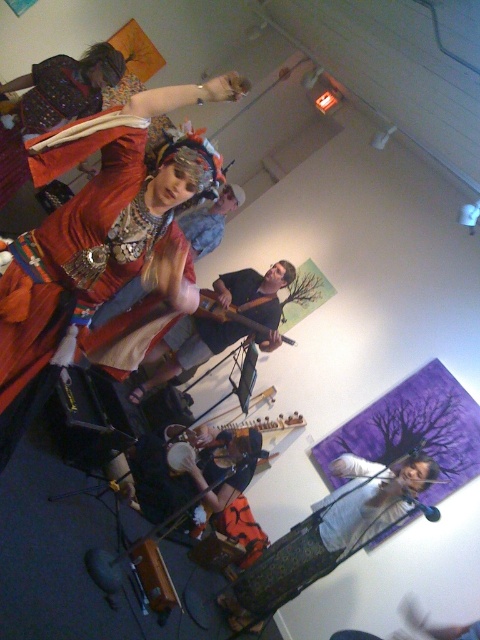
You are a photographer at the back of the room and want to capture both the white fabric shirt at center and the wooden stringed instrument at center in a single shot. Which object should you focus on first to ensure both are in frame?

You should focus on the white fabric shirt at center first since it is taller than the wooden stringed instrument at center, ensuring both will fit within the frame when centered.

You are setting up a music stand for the performer holding the microphone. The stand must be placed between the wooden stringed instrument at center and the wooden acoustic guitar at center. Which side of the instruments should the stand be placed closer to, considering their widths?

The wooden stringed instrument at center is wider than the wooden acoustic guitar at center. Therefore, the music stand should be placed closer to the narrower wooden acoustic guitar at center to ensure enough space between the instruments.